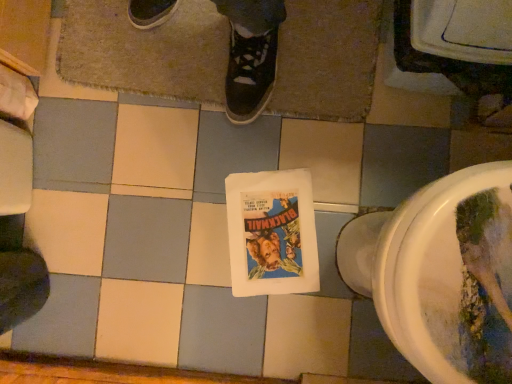
Question: Considering the relative positions of brown textured bath mat at upper center and white glossy toilet at lower right in the image provided, is brown textured bath mat at upper center to the right of white glossy toilet at lower right from the viewer's perspective?

Choices:
 (A) no
 (B) yes

Answer: (A)

Question: Can you confirm if brown textured bath mat at upper center is thinner than white glossy toilet at lower right?

Choices:
 (A) yes
 (B) no

Answer: (B)

Question: From the image's perspective, does brown textured bath mat at upper center appear higher than white glossy toilet at lower right?

Choices:
 (A) yes
 (B) no

Answer: (A)

Question: Are brown textured bath mat at upper center and white glossy toilet at lower right far apart?

Choices:
 (A) no
 (B) yes

Answer: (A)

Question: Does brown textured bath mat at upper center have a lesser height compared to white glossy toilet at lower right?

Choices:
 (A) yes
 (B) no

Answer: (A)

Question: Is the position of brown textured bath mat at upper center less distant than that of white glossy toilet at lower right?

Choices:
 (A) no
 (B) yes

Answer: (A)

Question: Can you confirm if brown textured bath mat at upper center is positioned to the right of matte paper comic book at center?

Choices:
 (A) yes
 (B) no

Answer: (B)

Question: From the image's perspective, does brown textured bath mat at upper center appear lower than matte paper comic book at center?

Choices:
 (A) no
 (B) yes

Answer: (A)

Question: Is brown textured bath mat at upper center not inside matte paper comic book at center?

Choices:
 (A) no
 (B) yes

Answer: (B)

Question: Could matte paper comic book at center be considered to be inside brown textured bath mat at upper center?

Choices:
 (A) no
 (B) yes

Answer: (A)

Question: Is brown textured bath mat at upper center smaller than matte paper comic book at center?

Choices:
 (A) no
 (B) yes

Answer: (A)

Question: Is matte paper comic book at center at the back of brown textured bath mat at upper center?

Choices:
 (A) yes
 (B) no

Answer: (B)

Question: Is matte paper comic book at center to the right of brown textured bath mat at upper center from the viewer's perspective?

Choices:
 (A) yes
 (B) no

Answer: (A)